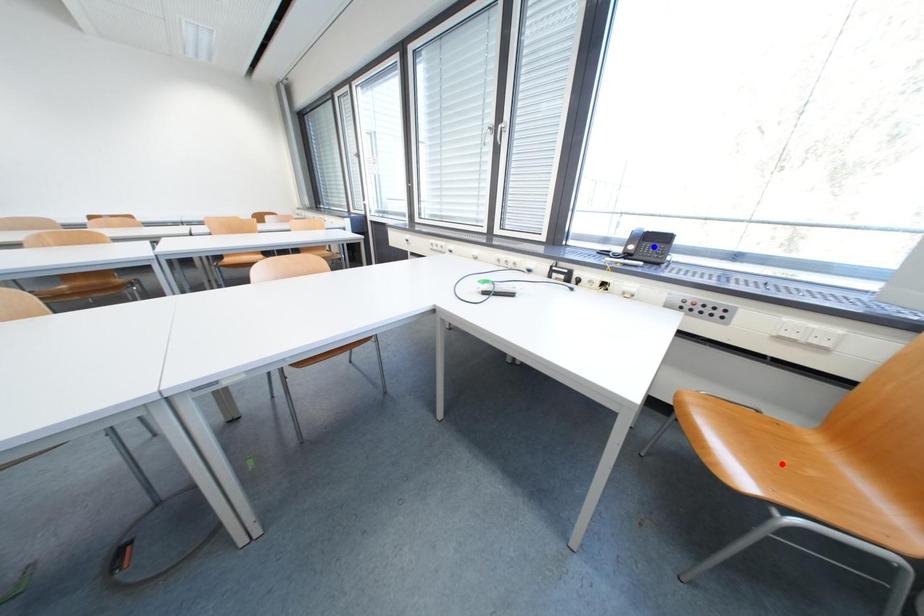
Question: Which of the two points in the image is closer to the camera?

Choices:
 (A) Blue point is closer.
 (B) Red point is closer.

Answer: (B)